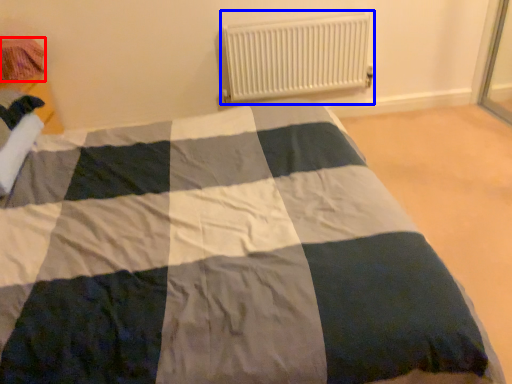
Question: Which point is further to the camera, material (highlighted by a red box) or radiator (highlighted by a blue box)?

Choices:
 (A) material
 (B) radiator

Answer: (B)